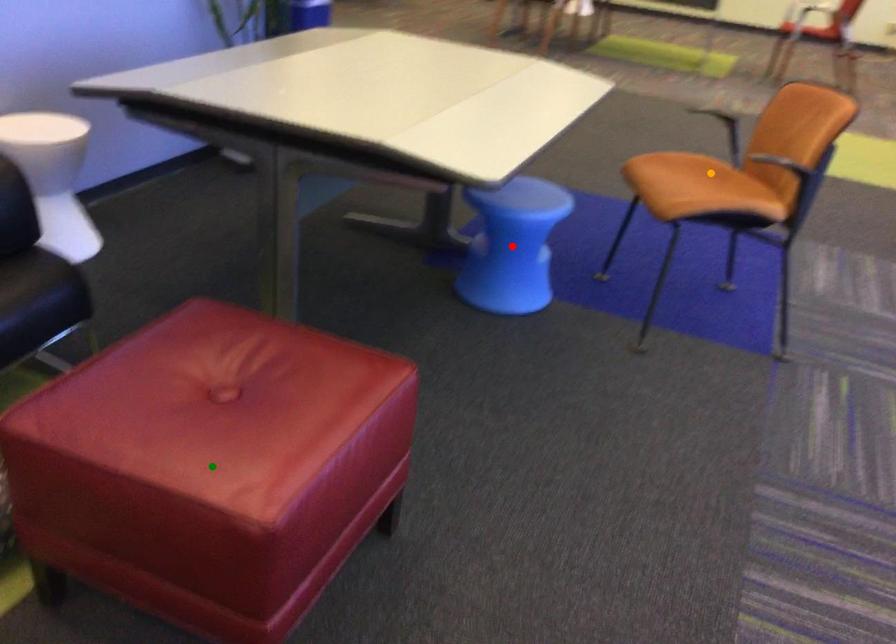
Order these from nearest to farthest:
green point | orange point | red point

green point → red point → orange point